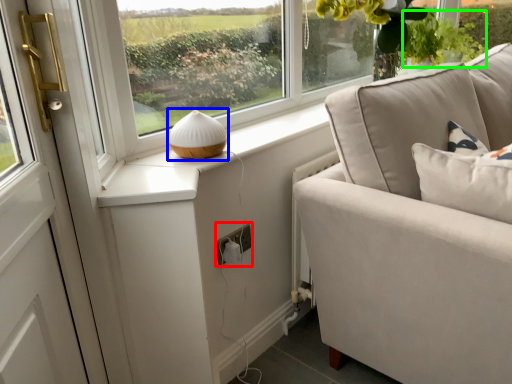
Question: Based on their relative distances, which object is farther from electric outlet (highlighted by a red box)? Choose from table lamp (highlighted by a blue box) and plant (highlighted by a green box).

Choices:
 (A) table lamp
 (B) plant

Answer: (B)